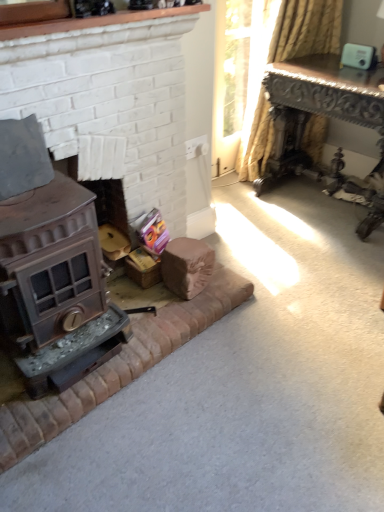
Question: From the image's perspective, does matte brown wood stove at left, which is the 1th fireplace in top-to-bottom order, appear higher than yellow striped fabric at upper right?

Choices:
 (A) yes
 (B) no

Answer: (B)

Question: Can you confirm if matte brown wood stove at left, placed as the second fireplace when sorted from bottom to top, is shorter than yellow striped fabric at upper right?

Choices:
 (A) yes
 (B) no

Answer: (A)

Question: Can you confirm if matte brown wood stove at left, which is the 1th fireplace in top-to-bottom order, is taller than yellow striped fabric at upper right?

Choices:
 (A) yes
 (B) no

Answer: (B)

Question: Does matte brown wood stove at left, placed as the second fireplace when sorted from bottom to top, come in front of yellow striped fabric at upper right?

Choices:
 (A) yes
 (B) no

Answer: (A)

Question: Is matte brown wood stove at left, placed as the second fireplace when sorted from bottom to top, thinner than yellow striped fabric at upper right?

Choices:
 (A) yes
 (B) no

Answer: (A)

Question: Visually, is bronze metallic fireplace at lower left, marked as the second fireplace in a top-to-bottom arrangement, positioned to the left or to the right of dark brown polished wood table at upper right?

Choices:
 (A) right
 (B) left

Answer: (B)

Question: Is bronze metallic fireplace at lower left, arranged as the 1th fireplace when ordered from the bottom, spatially inside dark brown polished wood table at upper right, or outside of it?

Choices:
 (A) outside
 (B) inside

Answer: (A)

Question: Is bronze metallic fireplace at lower left, arranged as the 1th fireplace when ordered from the bottom, bigger or smaller than dark brown polished wood table at upper right?

Choices:
 (A) big
 (B) small

Answer: (B)

Question: In the image, is bronze metallic fireplace at lower left, marked as the second fireplace in a top-to-bottom arrangement, positioned in front of or behind dark brown polished wood table at upper right?

Choices:
 (A) behind
 (B) front

Answer: (B)

Question: Based on their positions, is bronze metallic fireplace at lower left, marked as the second fireplace in a top-to-bottom arrangement, located to the left or right of matte brown wood stove at left, which is the 1th fireplace in top-to-bottom order?

Choices:
 (A) left
 (B) right

Answer: (A)

Question: Considering the positions of bronze metallic fireplace at lower left, marked as the second fireplace in a top-to-bottom arrangement, and matte brown wood stove at left, which is the 1th fireplace in top-to-bottom order, in the image, is bronze metallic fireplace at lower left, marked as the second fireplace in a top-to-bottom arrangement, wider or thinner than matte brown wood stove at left, which is the 1th fireplace in top-to-bottom order,?

Choices:
 (A) thin
 (B) wide

Answer: (B)

Question: Do you think bronze metallic fireplace at lower left, marked as the second fireplace in a top-to-bottom arrangement, is within matte brown wood stove at left, which is the 1th fireplace in top-to-bottom order, or outside of it?

Choices:
 (A) outside
 (B) inside

Answer: (A)

Question: Is point (72, 420) positioned closer to the camera than point (66, 139)?

Choices:
 (A) closer
 (B) farther

Answer: (A)

Question: In terms of height, does dark brown polished wood table at upper right look taller or shorter compared to yellow striped fabric at upper right?

Choices:
 (A) tall
 (B) short

Answer: (B)

Question: From a real-world perspective, relative to yellow striped fabric at upper right, is dark brown polished wood table at upper right vertically above or below?

Choices:
 (A) below
 (B) above

Answer: (A)